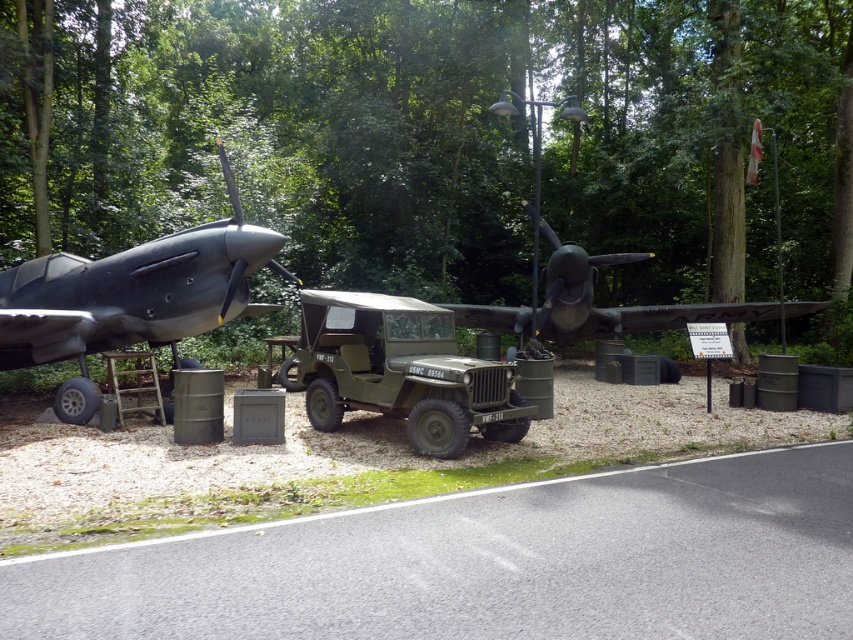
Between green textured tree at upper center and matte black airplane at center, which one is positioned higher?

green textured tree at upper center is higher up.

Does green textured tree at upper center have a smaller size compared to matte black airplane at center?

No, green textured tree at upper center is not smaller than matte black airplane at center.

The image size is (853, 640). Describe the element at coordinates (462, 136) in the screenshot. I see `green textured tree at upper center` at that location.

Locate an element on the screen. green textured tree at upper center is located at coordinates (462, 136).

Is green textured tree at upper center taller than matte green jeep at center?

Yes, green textured tree at upper center is taller than matte green jeep at center.

Between green textured tree at upper center and matte green jeep at center, which one appears on the left side from the viewer's perspective?

matte green jeep at center

Based on the photo, who is more distant from viewer, (201, 176) or (364, 310)?

Positioned behind is point (201, 176).

At what (x,y) coordinates should I click in order to perform the action: click on green textured tree at upper center. Please return your answer as a coordinate pair (x, y). Image resolution: width=853 pixels, height=640 pixels. Looking at the image, I should click on tap(462, 136).

From the picture: Does matte black airplane at left appear on the left side of matte black airplane at center?

Yes, matte black airplane at left is to the left of matte black airplane at center.

Consider the image. Is matte black airplane at left taller than matte black airplane at center?

In fact, matte black airplane at left may be shorter than matte black airplane at center.

Does point (200, 230) come behind point (643, 256)?

No, (200, 230) is closer to viewer.

At what (x,y) coordinates should I click in order to perform the action: click on matte black airplane at left. Please return your answer as a coordinate pair (x, y). The width and height of the screenshot is (853, 640). Looking at the image, I should click on (131, 298).